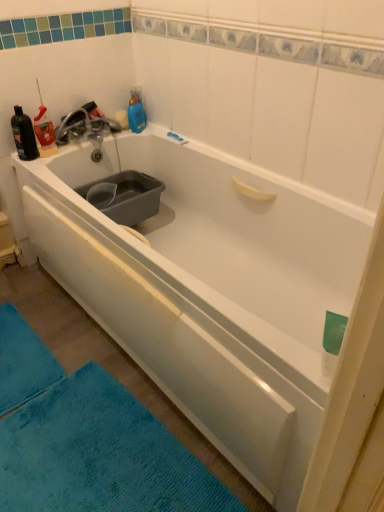
The width and height of the screenshot is (384, 512). I want to click on blue soft bath mat at lower left, so click(23, 361).

This screenshot has width=384, height=512. I want to click on blue soft bath mat at lower left, so click(x=23, y=361).

Which is closer, [110,130] or [52,374]?

The point [52,374] is closer to the camera.

From the picture: Can you confirm if matte silver faucet at upper left is wider than blue soft bath mat at lower left?

Incorrect, the width of matte silver faucet at upper left does not surpass that of blue soft bath mat at lower left.

The height and width of the screenshot is (512, 384). What are the coordinates of `tap above the blue soft bath mat at lower left (from a real-world perspective)` in the screenshot? It's located at (84, 126).

Can you tell me how much matte silver faucet at upper left and blue soft bath mat at lower left differ in facing direction?

matte silver faucet at upper left and blue soft bath mat at lower left are facing 0.172 degrees away from each other.

Is blue soft bath mat at lower left to the left of matte silver faucet at upper left from the viewer's perspective?

Yes, blue soft bath mat at lower left is to the left of matte silver faucet at upper left.

Can you confirm if blue soft bath mat at lower left is bigger than matte silver faucet at upper left?

Incorrect, blue soft bath mat at lower left is not larger than matte silver faucet at upper left.

Which point is more distant from viewer, (8, 349) or (75, 131)?

The point (75, 131) is farther.

Between blue soft bath mat at lower left and matte silver faucet at upper left, which one has less height?

With less height is blue soft bath mat at lower left.

Looking at this image, looking at the image, does matte silver faucet at upper left seem bigger or smaller compared to black matte bottle at upper left?

Clearly, matte silver faucet at upper left is larger in size than black matte bottle at upper left.

Are matte silver faucet at upper left and black matte bottle at upper left located far from each other?

No, matte silver faucet at upper left is not far from black matte bottle at upper left.

Which is more distant, (60, 132) or (26, 156)?

The point (60, 132) is behind.

From the image's perspective, is black matte bottle at upper left located above or below matte silver faucet at upper left?

From the image's perspective, black matte bottle at upper left appears below matte silver faucet at upper left.

Is matte silver faucet at upper left at the back of black matte bottle at upper left?

No, black matte bottle at upper left's orientation is not away from matte silver faucet at upper left.

Considering the sizes of objects black matte bottle at upper left and matte silver faucet at upper left in the image provided, who is smaller, black matte bottle at upper left or matte silver faucet at upper left?

With smaller size is black matte bottle at upper left.

Is point (46, 370) more distant than point (13, 132)?

No, it is in front of (13, 132).

Is blue soft bath mat at lower left oriented away from black matte bottle at upper left?

blue soft bath mat at lower left is not turned away from black matte bottle at upper left.

From a real-world perspective, is blue soft bath mat at lower left physically below black matte bottle at upper left?

Yes, from a real-world perspective, blue soft bath mat at lower left is under black matte bottle at upper left.

Does black matte bottle at upper left turn towards blue soft bath mat at lower left?

No, black matte bottle at upper left is not aimed at blue soft bath mat at lower left.

From the image's perspective, who appears lower, black matte bottle at upper left or blue soft bath mat at lower left?

blue soft bath mat at lower left.

Is black matte bottle at upper left bigger than blue soft bath mat at lower left?

No.

Is blue soft bath mat at lower left inside black matte bottle at upper left?

No, blue soft bath mat at lower left is not surrounded by black matte bottle at upper left.

Find the location of a particular element. The height and width of the screenshot is (512, 384). tap above the blue soft bath mat at lower left (from a real-world perspective) is located at coordinates (84, 126).

Where is `bath mat on the left side of matte silver faucet at upper left`? bath mat on the left side of matte silver faucet at upper left is located at coordinates (23, 361).

Estimate the real-world distances between objects in this image. Which object is further from black matte bottle at upper left, matte silver faucet at upper left or blue soft bath mat at lower left?

The object further to black matte bottle at upper left is blue soft bath mat at lower left.

When comparing their distances from matte silver faucet at upper left, does black matte bottle at upper left or blue soft bath mat at lower left seem closer?

Among the two, black matte bottle at upper left is located nearer to matte silver faucet at upper left.

Estimate the real-world distances between objects in this image. Which object is closer to blue soft bath mat at lower left, matte silver faucet at upper left or black matte bottle at upper left?

Among the two, black matte bottle at upper left is located nearer to blue soft bath mat at lower left.

Which object lies nearer to the anchor point black matte bottle at upper left, blue soft bath mat at lower left or matte silver faucet at upper left?

Based on the image, matte silver faucet at upper left appears to be nearer to black matte bottle at upper left.

When comparing their distances from matte silver faucet at upper left, does blue soft bath mat at lower left or black matte bottle at upper left seem further?

blue soft bath mat at lower left is further to matte silver faucet at upper left.

Estimate the real-world distances between objects in this image. Which object is closer to blue soft bath mat at lower left, black matte bottle at upper left or matte silver faucet at upper left?

The object closer to blue soft bath mat at lower left is black matte bottle at upper left.

Where is `bottle between matte silver faucet at upper left and blue soft bath mat at lower left from top to bottom`? The height and width of the screenshot is (512, 384). bottle between matte silver faucet at upper left and blue soft bath mat at lower left from top to bottom is located at coordinates (24, 135).